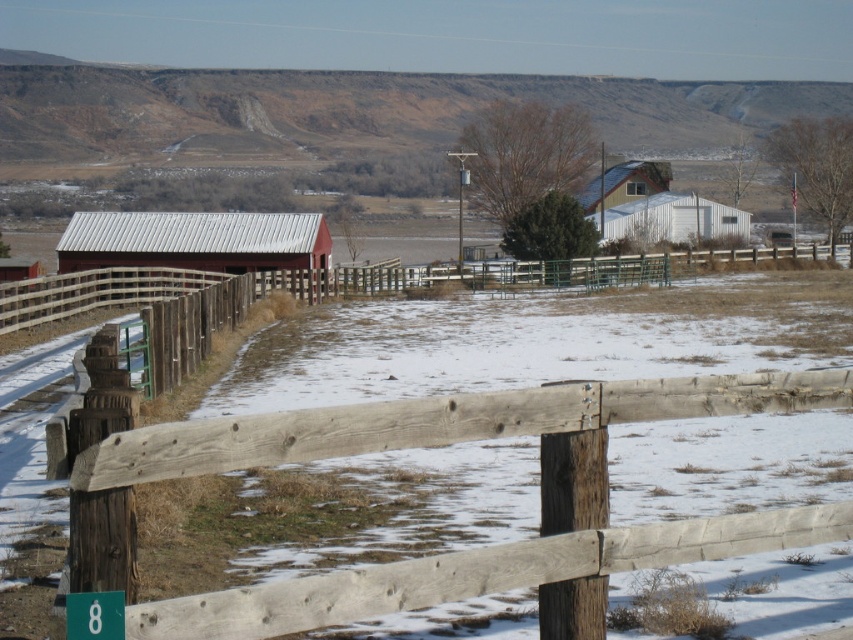
Is point (375, 433) behind point (705, 227)?

No, it is not.

Which is in front, point (437, 444) or point (637, 168)?

Positioned in front is point (437, 444).

Where is `weathered wood fence at center`? The height and width of the screenshot is (640, 853). weathered wood fence at center is located at coordinates (440, 422).

Identify the location of weathered wood fence at center. (440, 422).

Which of these two, weathered wood fence at center or metallic red barn at center, stands shorter?

With less height is weathered wood fence at center.

Image resolution: width=853 pixels, height=640 pixels. Identify the location of weathered wood fence at center. (440, 422).

Between metallic red barn at center and white corrugated metal barn at center, which one appears on the left side from the viewer's perspective?

metallic red barn at center is more to the left.

Does metallic red barn at center have a lesser width compared to white corrugated metal barn at center?

No, metallic red barn at center is not thinner than white corrugated metal barn at center.

Is point (83, 221) positioned before point (643, 182)?

Yes, it is in front of point (643, 182).

Where is `metallic red barn at center`? metallic red barn at center is located at coordinates (202, 243).